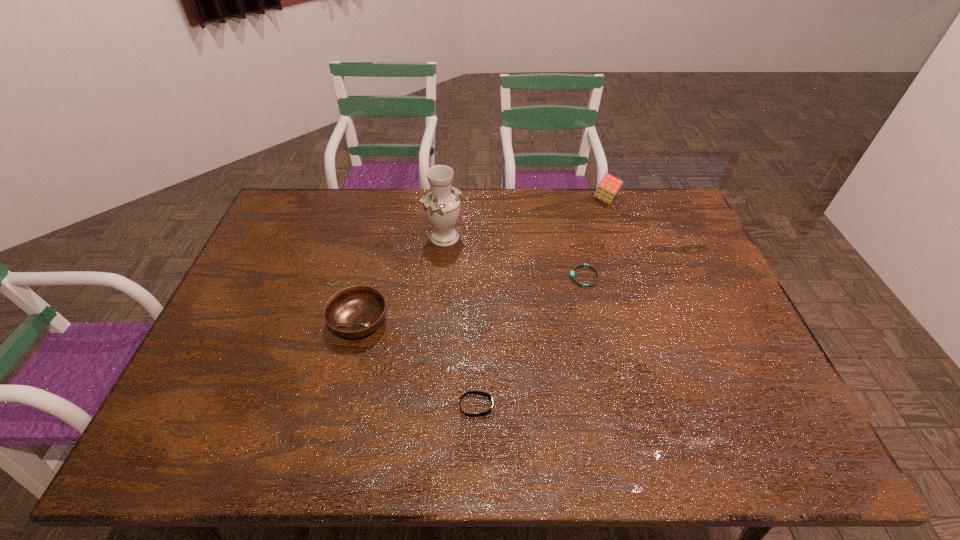
In order to click on blank area at the near edge in this screenshot , I will do `click(480, 462)`.

In the image, there is a desktop. Where is `vacant space at the right edge`? vacant space at the right edge is located at coordinates (746, 383).

Identify the location of vacant area at the far left corner of the desktop. (317, 209).

Where is `vacant area between the cube and the left wristband`? The width and height of the screenshot is (960, 540). vacant area between the cube and the left wristband is located at coordinates 541,302.

You are a GUI agent. You are given a task and a screenshot of the screen. Output one action in this format:
    pyautogui.click(x=<x>, y=<y>)
    Task: Click on the vacant area that lies between the soup bowl and the fourth object from right to left
    The height and width of the screenshot is (540, 960).
    Given the screenshot: What is the action you would take?
    click(401, 279)

The height and width of the screenshot is (540, 960). In order to click on vacant space that's between the taller wristband and the farther wristband in this screenshot , I will do `click(530, 341)`.

Where is `vacant area that lies between the leftmost object and the second tallest object`? Image resolution: width=960 pixels, height=540 pixels. vacant area that lies between the leftmost object and the second tallest object is located at coordinates (482, 260).

Locate an element on the screen. vacant space that is in between the second object from left to right and the fourth tallest object is located at coordinates (461, 321).

Where is `free space between the farther wristband and the soup bowl`? The width and height of the screenshot is (960, 540). free space between the farther wristband and the soup bowl is located at coordinates (471, 299).

Where is `vacant area that lies between the nearest object and the second tallest object`? This screenshot has width=960, height=540. vacant area that lies between the nearest object and the second tallest object is located at coordinates (541, 302).